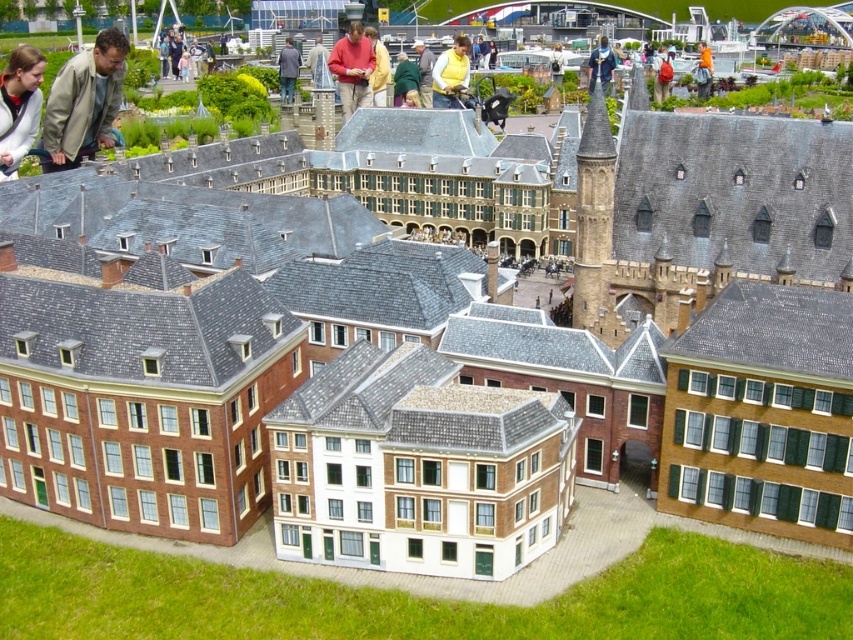
You are a visitor in the European town square model and want to place your belongings on the ground. If you put both the orange backpack at center and the matte gray coat at center on the ground, which one will have its top closer to the ground?

The orange backpack at center is shorter than the matte gray coat at center, so its top will be closer to the ground compared to the matte gray coat at center.

You are standing in the European town square model and notice two people wearing a matte black jacket at upper left and a matte red shirt at center. Which person is nearer to you?

The matte black jacket at upper left is closer to the viewer than the matte red shirt at center.